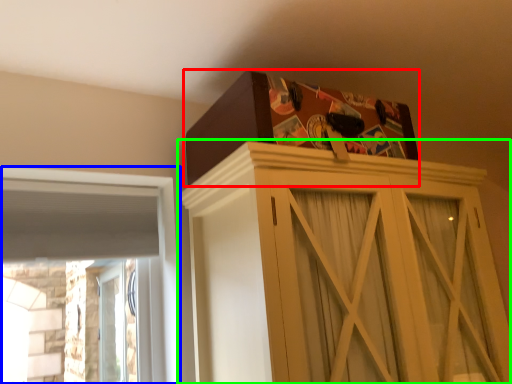
Question: Which object is the farthest from cardboard box (highlighted by a red box)? Choose among these: window (highlighted by a blue box) or cupboard (highlighted by a green box).

Choices:
 (A) window
 (B) cupboard

Answer: (A)